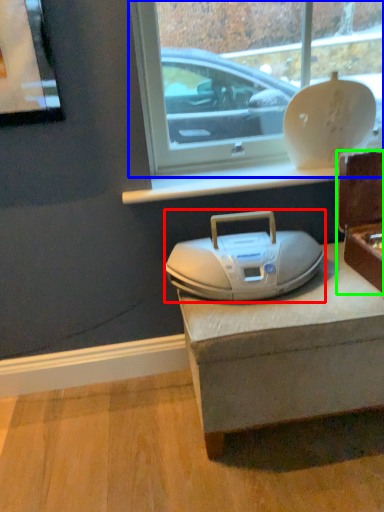
Question: Estimate the real-world distances between objects in this image. Which object is closer to appliance (highlighted by a red box), window (highlighted by a blue box) or box (highlighted by a green box)?

Choices:
 (A) window
 (B) box

Answer: (B)